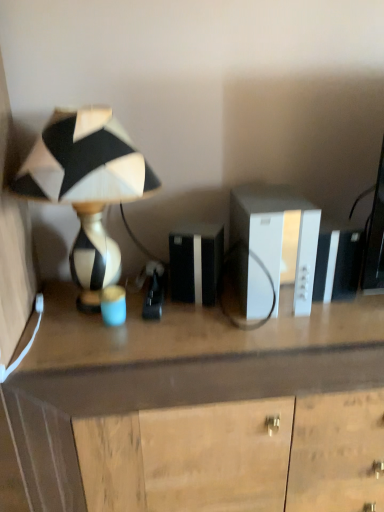
Identify the location of free spot to the right of black and white ceramic lamp at left. The width and height of the screenshot is (384, 512). (213, 328).